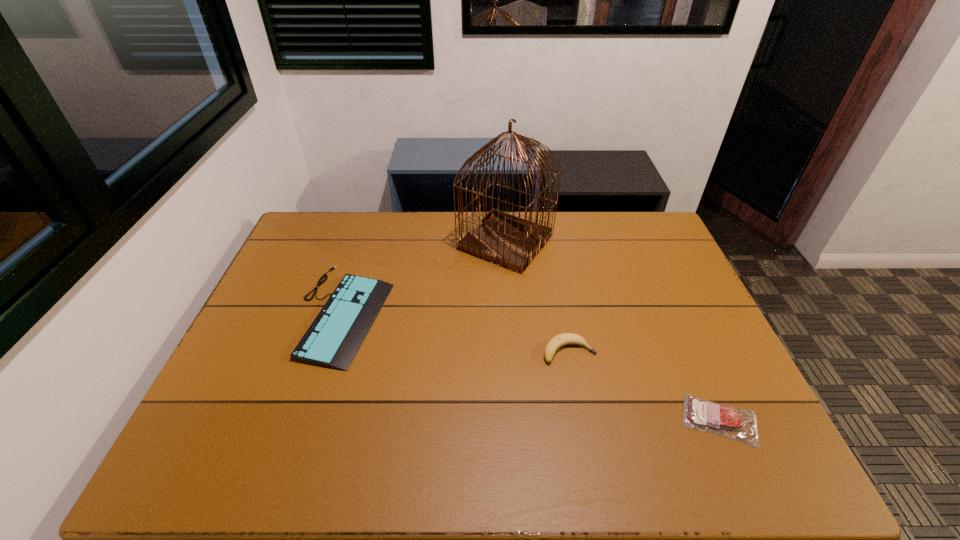
You are a GUI agent. You are given a task and a screenshot of the screen. Output one action in this format:
    pyautogui.click(x=<x>, y=<y>)
    Task: Click on the unoccupied position between the steak and the third tallest object
    
    Given the screenshot: What is the action you would take?
    pyautogui.click(x=531, y=366)

Where is `free space between the steak and the birdcage`? free space between the steak and the birdcage is located at coordinates (612, 330).

The image size is (960, 540). Identify the location of empty space that is in between the birdcage and the computer keyboard. (424, 277).

Find the location of a particular element. empty space between the third tallest object and the steak is located at coordinates (531, 366).

The height and width of the screenshot is (540, 960). I want to click on vacant area that lies between the leftmost object and the nearest object, so click(x=531, y=366).

Locate an element on the screen. free spot between the birdcage and the leftmost object is located at coordinates (424, 277).

You are a GUI agent. You are given a task and a screenshot of the screen. Output one action in this format:
    pyautogui.click(x=<x>, y=<y>)
    Task: Click on the vacant area between the computer keyboard and the banana
    This screenshot has width=960, height=540.
    Given the screenshot: What is the action you would take?
    pyautogui.click(x=456, y=332)

Image resolution: width=960 pixels, height=540 pixels. Identify the location of free space between the nearest object and the leftmost object. (531, 366).

In order to click on free space between the shortest object and the third shortest object in this screenshot , I will do `click(644, 386)`.

This screenshot has height=540, width=960. In order to click on vacant area that lies between the banana and the birdcage in this screenshot , I will do `click(538, 296)`.